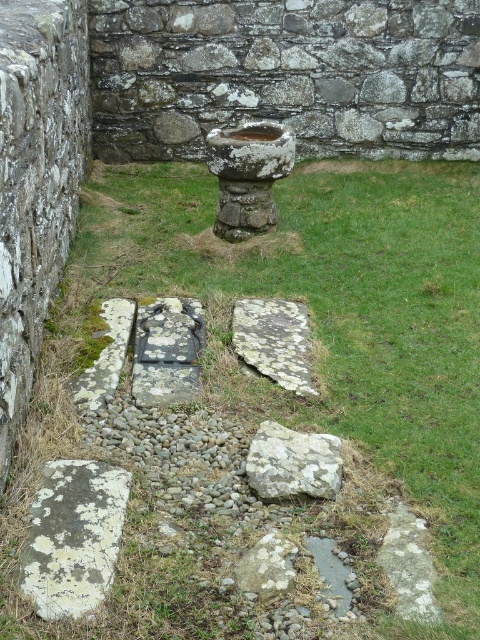
You are a maintenance worker who needs to clean both the rusty stone bird bath at center and the speckled stone at center. You have a cleaning tool that can reach up to 1.5 meters. Can you clean both objects without moving the tool?

The distance between the rusty stone bird bath at center and the speckled stone at center is 1.52 meters, which is slightly beyond the tool reach of 1.5 meters. Therefore, you cannot clean both objects without moving the tool.